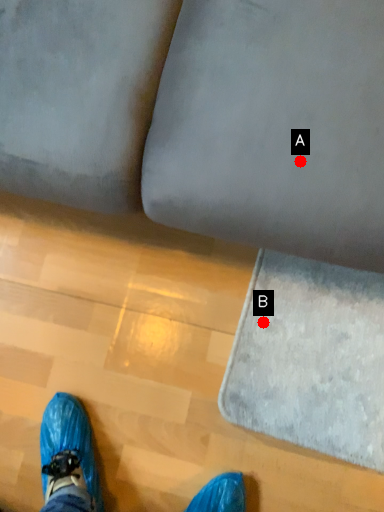
Question: Two points are circled on the image, labeled by A and B beside each circle. Which point appears farthest from the camera in this image?

Choices:
 (A) A is further
 (B) B is further

Answer: (B)